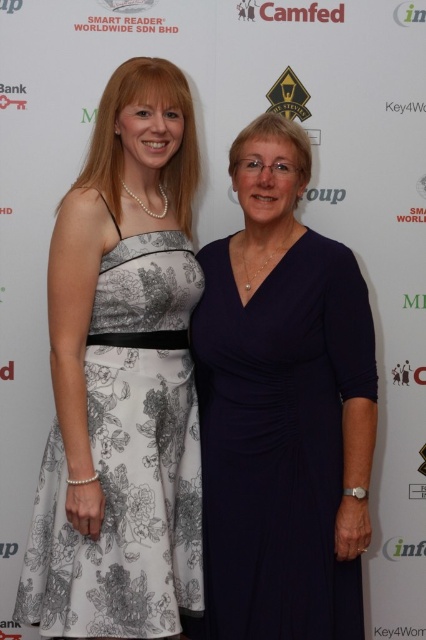
You are a photographer at a corporate event. You need to capture a photo of the two women wearing the navy blue dress at center and the white floral fabric dress at left. Based on their positions, which dress is on the left side of the image?

The white floral fabric dress at left is positioned on the left side of the image, while the navy blue dress at center is on the right side.

You are a photographer at a corporate event. You need to decide which dress to focus on for a closeup shot. The navy blue dress at center and the white floral fabric dress at left are both in frame. Which dress should you choose if you want to capture more details of the dress due to its size?

The navy blue dress at center is bigger than the white floral fabric dress at left, so you should choose the navy blue dress at center to capture more details because its larger size allows for better focus and detail visibility.

You are a photographer at a corporate event. You need to adjust the lighting to ensure both the navy blue dress at center and the white floral fabric dress at left are well lit. Based on their positions, which dress is higher in the frame?

The navy blue dress at center is above the white floral fabric dress at left, so the navy blue dress at center is higher in the frame.